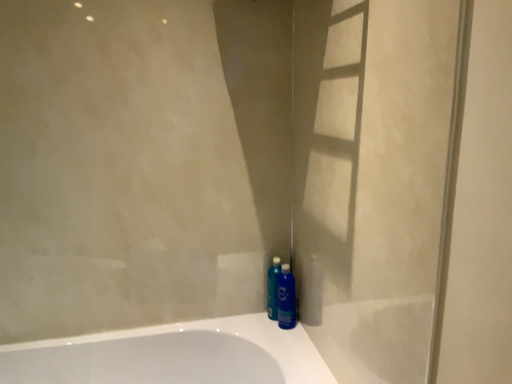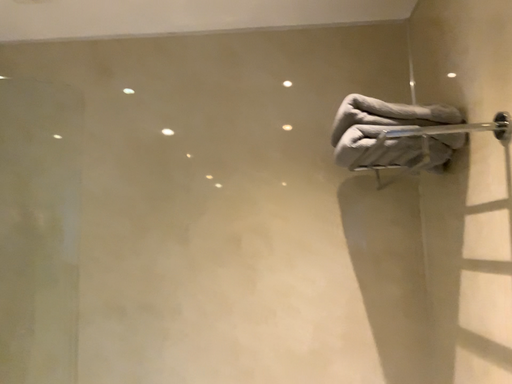
Question: Which way did the camera rotate in the video?

Choices:
 (A) rotated left
 (B) rotated right

Answer: (A)